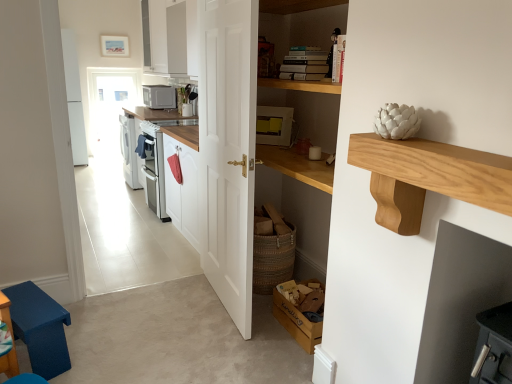
Question: Does wooden cardboard box at lower center appear on the right side of matte gray microwave at upper center, acting as the second appliance starting from the right?

Choices:
 (A) yes
 (B) no

Answer: (A)

Question: Considering the relative sizes of wooden cardboard box at lower center and matte gray microwave at upper center, positioned as the 1th appliance in top-to-bottom order, in the image provided, is wooden cardboard box at lower center taller than matte gray microwave at upper center, positioned as the 1th appliance in top-to-bottom order,?

Choices:
 (A) no
 (B) yes

Answer: (A)

Question: From a real-world perspective, is wooden cardboard box at lower center located higher than matte gray microwave at upper center, positioned as the 1th appliance in top-to-bottom order?

Choices:
 (A) yes
 (B) no

Answer: (B)

Question: Considering the relative positions of wooden cardboard box at lower center and matte gray microwave at upper center, the 1th appliance when ordered from left to right, in the image provided, is wooden cardboard box at lower center to the left of matte gray microwave at upper center, the 1th appliance when ordered from left to right, from the viewer's perspective?

Choices:
 (A) yes
 (B) no

Answer: (B)

Question: Is wooden cardboard box at lower center positioned in front of matte gray microwave at upper center, which appears as the 2th appliance when viewed from the front?

Choices:
 (A) no
 (B) yes

Answer: (B)

Question: From a real-world perspective, is wooden cardboard box at lower center located beneath matte gray microwave at upper center, positioned as the 1th appliance in top-to-bottom order?

Choices:
 (A) no
 (B) yes

Answer: (B)

Question: Is matte yellow appliance at center, which ranks as the second appliance in back-to-front order, smaller than light wood shelf at upper right?

Choices:
 (A) no
 (B) yes

Answer: (B)

Question: Is matte yellow appliance at center, which ranks as the second appliance in back-to-front order, far away from light wood shelf at upper right?

Choices:
 (A) no
 (B) yes

Answer: (B)

Question: Considering the relative positions of matte yellow appliance at center, the 2th appliance positioned from the left, and light wood shelf at upper right in the image provided, is matte yellow appliance at center, the 2th appliance positioned from the left, to the left of light wood shelf at upper right from the viewer's perspective?

Choices:
 (A) yes
 (B) no

Answer: (A)

Question: Would you say light wood shelf at upper right is part of matte yellow appliance at center, which is the first appliance in right-to-left order,'s contents?

Choices:
 (A) yes
 (B) no

Answer: (B)

Question: Is the position of matte yellow appliance at center, acting as the 2th appliance starting from the top, more distant than that of light wood shelf at upper right?

Choices:
 (A) no
 (B) yes

Answer: (B)

Question: Is matte yellow appliance at center, which ranks as the second appliance in back-to-front order, oriented towards light wood shelf at upper right?

Choices:
 (A) no
 (B) yes

Answer: (A)

Question: Is blue fabric step stool at lower left positioned far away from white wooden door at center?

Choices:
 (A) no
 (B) yes

Answer: (B)